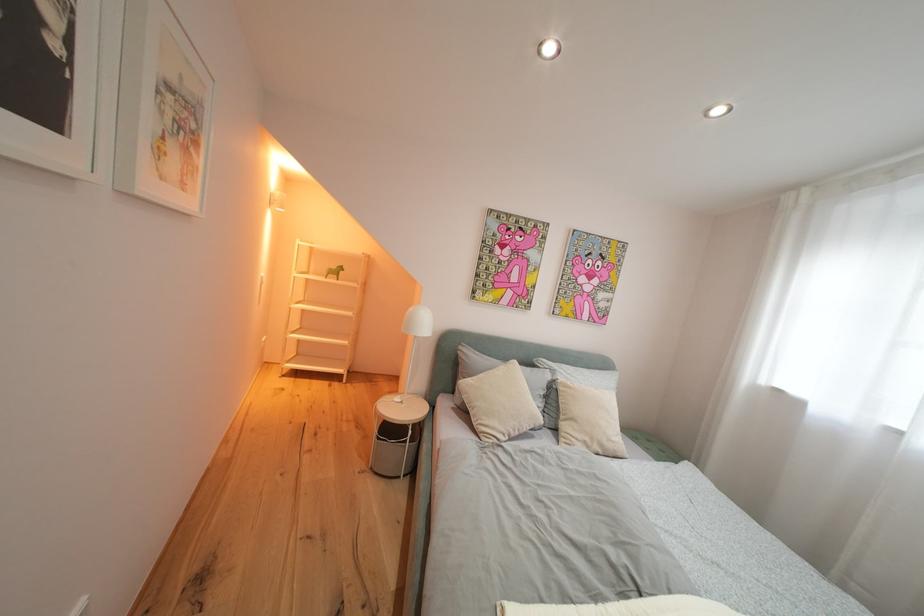
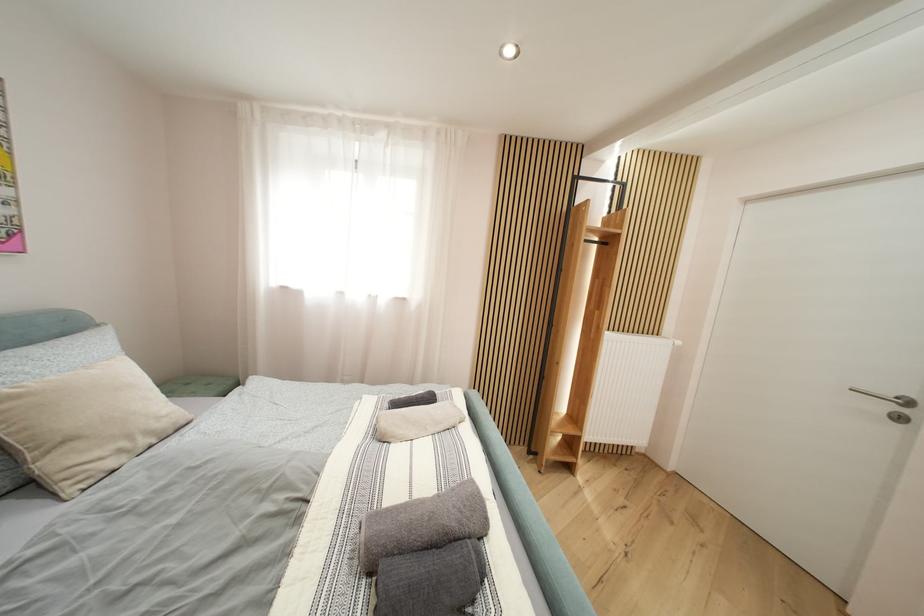
First-person continuous shooting, in which direction is the camera rotating?

The camera rotated toward right-down.